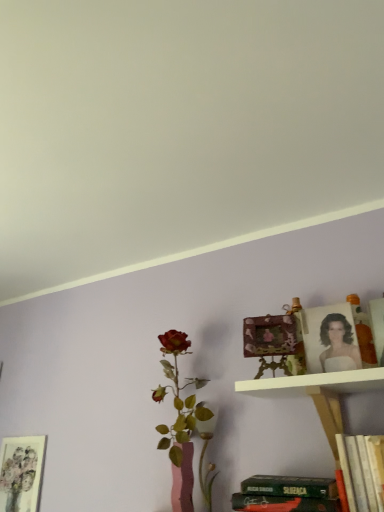
Question: In terms of size, does white matte wall at upper center appear bigger or smaller than matte floral print at lower left, positioned as the first picture frame in bottom-to-top order?

Choices:
 (A) small
 (B) big

Answer: (B)

Question: From a real-world perspective, is white matte wall at upper center physically located above or below matte floral print at lower left, the first picture frame from the back?

Choices:
 (A) below
 (B) above

Answer: (B)

Question: Which object is the farthest from the white wooden shelf at upper center?

Choices:
 (A) matte floral print at lower left, placed as the 3th picture frame when sorted from right to left
 (B) wooden carved frame at upper right, which is the 2th picture frame in back-to-front order
 (C) matte gold picture frame at upper right, placed as the third picture frame when sorted from back to front
 (D) white matte wall at upper center

Answer: (A)

Question: Estimate the real-world distances between objects in this image. Which object is farther from the white matte wall at upper center?

Choices:
 (A) white wooden shelf at upper center
 (B) matte floral print at lower left, placed as the 3th picture frame when sorted from right to left
 (C) wooden carved frame at upper right, which is counted as the second picture frame, starting from the top
 (D) matte gold picture frame at upper right, the 1th picture frame when ordered from front to back

Answer: (B)